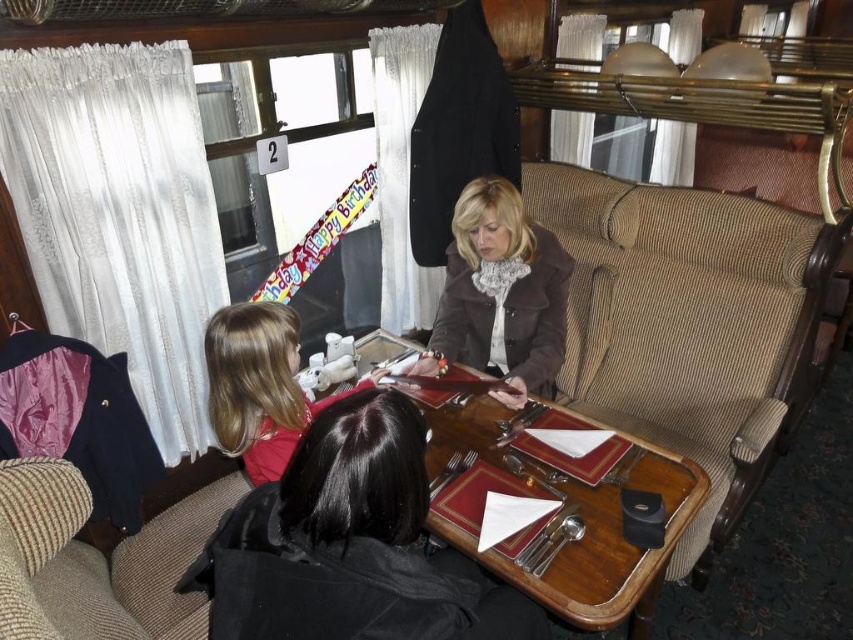
Consider the image. You are sitting in the beige corduroy armchair at lower left and want to hand a book to the person in the beige corduroy armchair at right. In which direction should you move to reach them?

You should move upwards to reach the beige corduroy armchair at right, as it is positioned above the beige corduroy armchair at lower left.

You are sitting in the beige corduroy armchair at lower left and want to pass a book to the person in the beige corduroy armchair at right. Which direction should you move to reach them?

You should move to the right to reach the beige corduroy armchair at right since it is positioned to the right of the beige corduroy armchair at lower left.